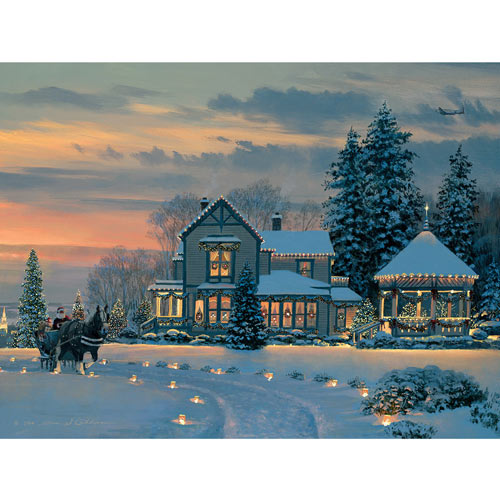
Find the location of a particular element. chimney is located at coordinates (276, 223), (204, 201).